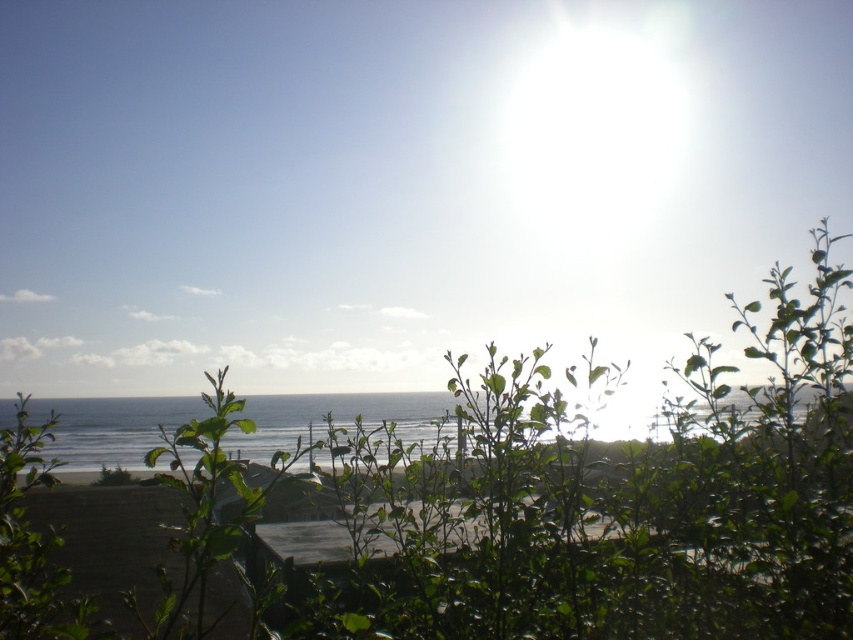
Question: Which of the following is the closest to the observer?

Choices:
 (A) green leafy bush at center
 (B) clear blue water at center

Answer: (A)

Question: Does green leafy bush at center have a smaller size compared to clear blue water at center?

Choices:
 (A) no
 (B) yes

Answer: (A)

Question: Is green leafy bush at center to the left of clear blue water at center from the viewer's perspective?

Choices:
 (A) no
 (B) yes

Answer: (B)

Question: Which point is closer to the camera?

Choices:
 (A) green leafy bush at center
 (B) clear blue water at center

Answer: (A)

Question: Can you confirm if green leafy bush at center is thinner than clear blue water at center?

Choices:
 (A) no
 (B) yes

Answer: (A)